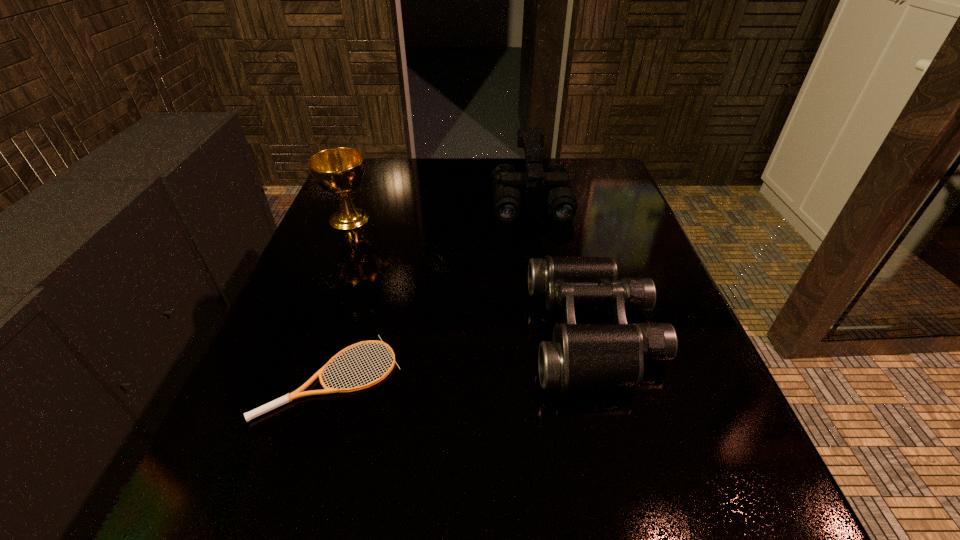
The image size is (960, 540). In order to click on free space located 0.140m on the back of the shortest object in this screenshot , I will do `click(360, 284)`.

Identify the location of object that is at the far edge. The width and height of the screenshot is (960, 540). (562, 205).

Find the location of `chalice that is positioned at the left edge`. chalice that is positioned at the left edge is located at coordinates (339, 170).

In order to click on tennis racket positioned at the left edge in this screenshot , I will do `click(298, 393)`.

What are the coordinates of `object present at the far right corner` in the screenshot? It's located at (562, 205).

You are a GUI agent. You are given a task and a screenshot of the screen. Output one action in this format:
    pyautogui.click(x=<x>, y=<y>)
    Task: Click on the vacant space at the far edge of the desktop
    
    Given the screenshot: What is the action you would take?
    pyautogui.click(x=468, y=199)

Find the location of a particular element. The width and height of the screenshot is (960, 540). vacant space at the near edge of the desktop is located at coordinates (570, 517).

The width and height of the screenshot is (960, 540). Identify the location of free space at the left edge. (222, 427).

Where is `vacant area at the right edge`? vacant area at the right edge is located at coordinates (662, 411).

Where is `free space at the far right corner of the desktop`? The image size is (960, 540). free space at the far right corner of the desktop is located at coordinates (575, 175).